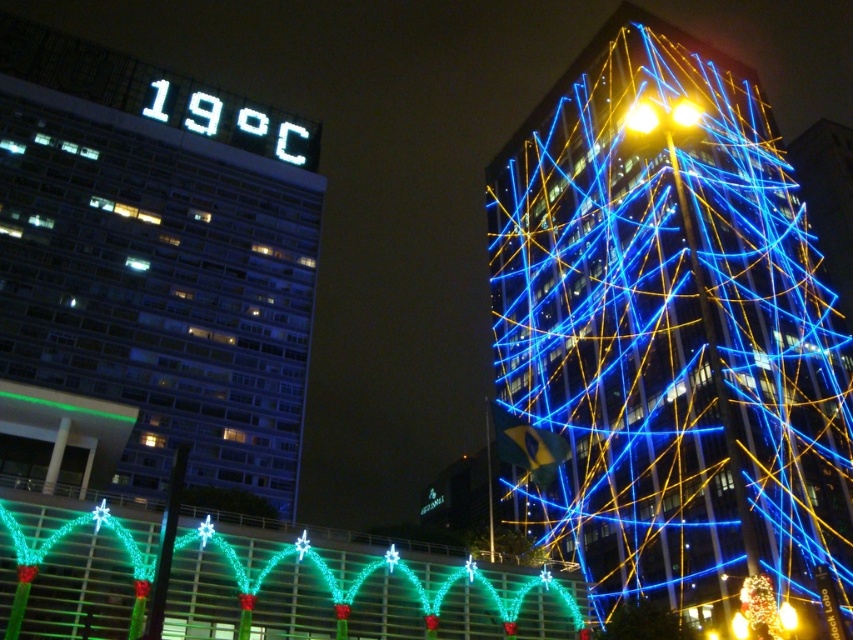
Looking at this image, you are a city planner analyzing the urban night scene. You need to determine which object, the white digital sign at upper center or the green glossy lights at center, occupies a higher position in the image. Based on the scene description, which one is taller?

The white digital sign at upper center is taller than the green glossy lights at center according to the description.

You are a drone operator trying to deliver a package from the white digital sign at upper center to the yellow metallic light at upper right. The drone has a maximum range of 50 meters. Can the drone complete the delivery without needing a recharge?

The white digital sign at upper center is 52.02 meters from the yellow metallic light at upper right. Since the drone has a maximum range of 50 meters, it cannot complete the delivery without needing a recharge.

You are a delivery drone flying over the city at night. You need to deliver a package to the building with the green glossy lights at center. The white digital sign at upper center shows the temperature. Which building should you head towards based on the sign and lights?

The white digital sign at upper center is to the left of the green glossy lights at center. Therefore, the building with the green glossy lights at center is to the right of the white digital sign at upper center, so you should head towards the building on the right side of the white digital sign at upper center.